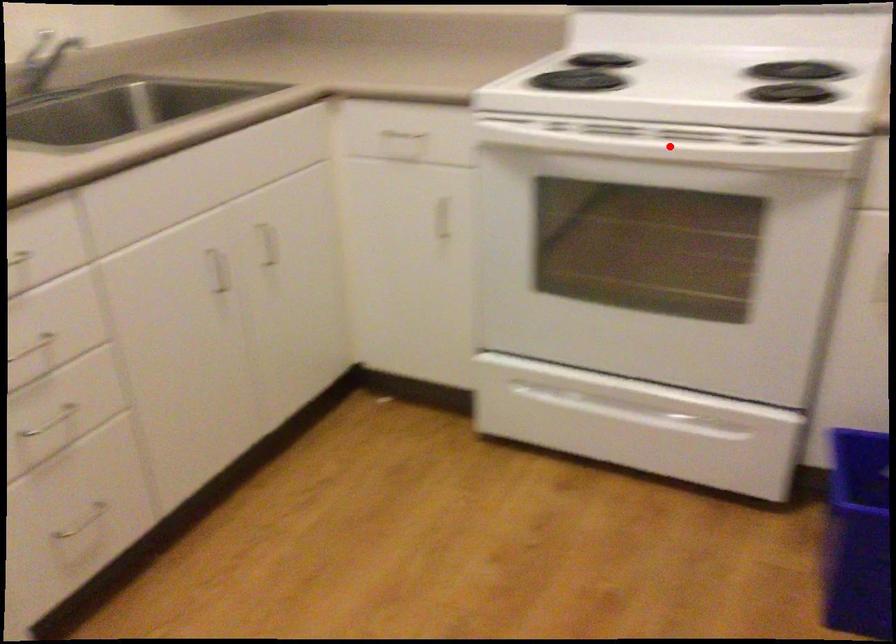
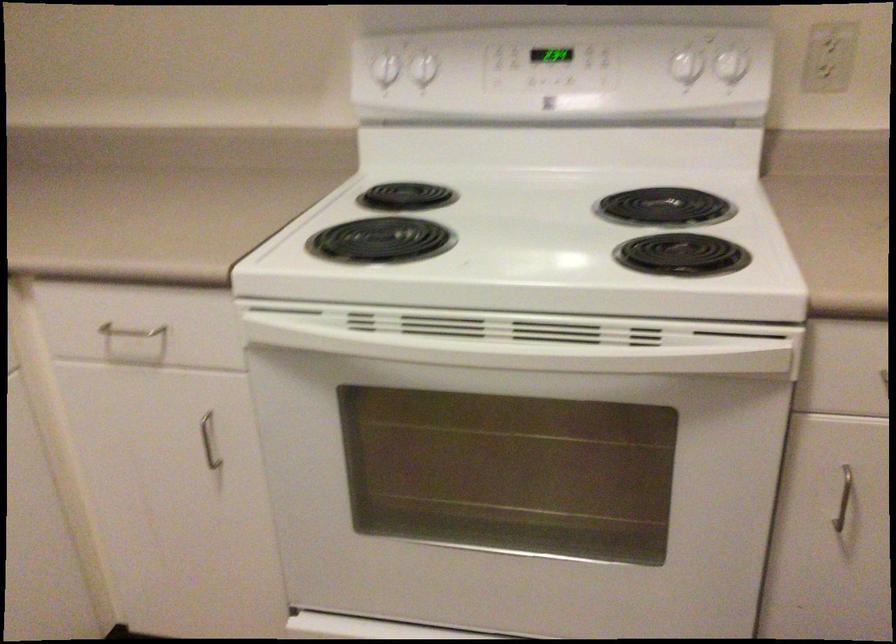
In the second image, find the point that corresponds to the highlighted location in the first image.

(526, 339)